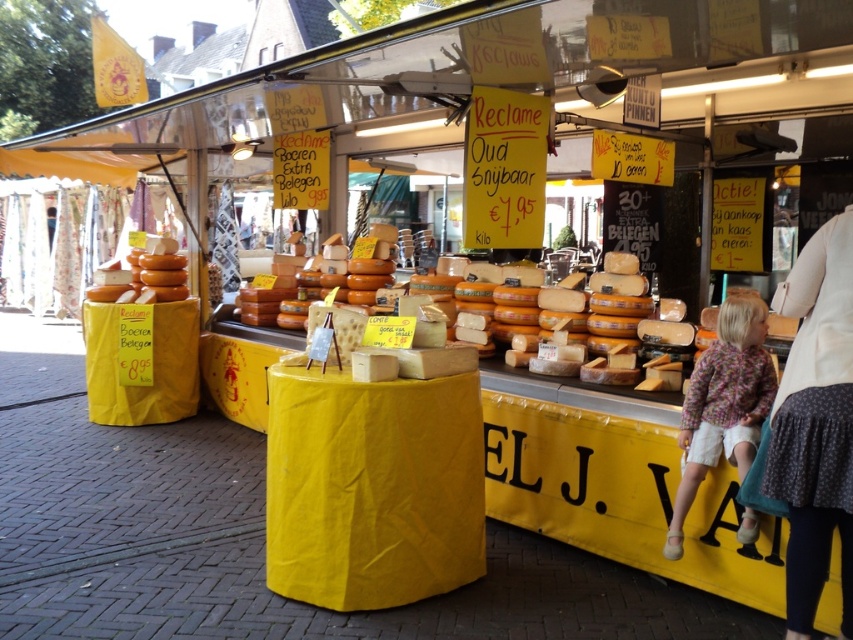
Which object corresponds to the coordinates point (560, 385)?

The orange cheese at center corresponds to the coordinates point (560, 385).

You are standing at the entrance of the cheese market stall. You notice two points marked on the sign in front of you. The first point is at coordinate (738, 384) and the second is at (94, 298). Which point is closer to you?

The point at coordinate (738, 384) is closer to you than the point at (94, 298).

You are a customer standing at the entrance of the market stall. You want to buy the orange cheese at center. According to the stall layout, where should you look to find it?

The orange cheese at center is located at the 2D coordinates point [560,385].